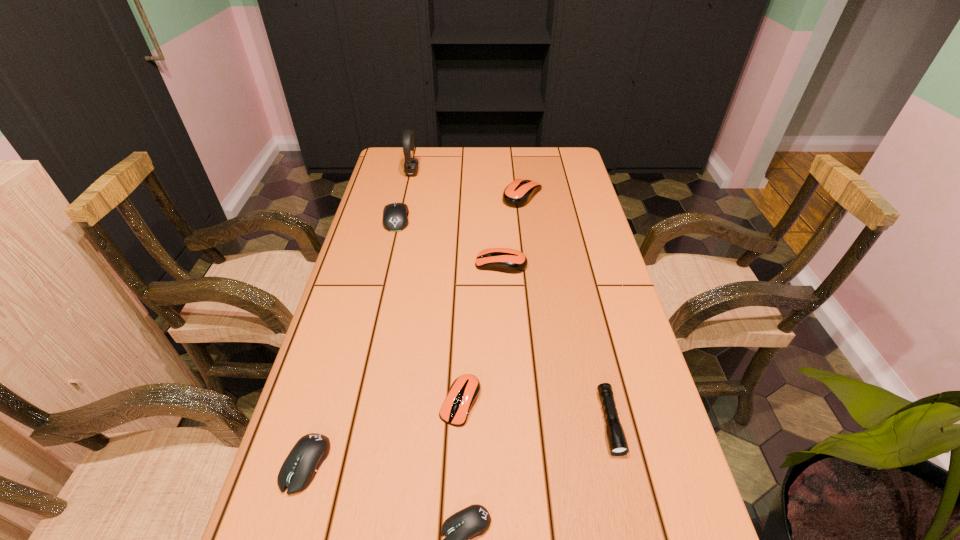
You are a GUI agent. You are given a task and a screenshot of the screen. Output one action in this format:
    pyautogui.click(x=<x>, y=<y>)
    Task: Click on the free space between the rightmost object and the biggest orange computer mouse
    
    Given the screenshot: What is the action you would take?
    pyautogui.click(x=566, y=308)

In order to click on vacant point located between the farthest black computer equipment and the black flashlight in this screenshot , I will do `click(503, 320)`.

Where is `free area in between the farthest black computer equipment and the fifth farthest computer equipment`? The width and height of the screenshot is (960, 540). free area in between the farthest black computer equipment and the fifth farthest computer equipment is located at coordinates (351, 341).

Find the location of a particular element. This screenshot has height=540, width=960. object that is the closest to the third nearest computer equipment is located at coordinates (474, 520).

Identify which object is located as the third nearest to the fourth nearest computer equipment. Please provide its 2D coordinates. Your answer should be formatted as a tuple, i.e. [(x, y)], where the tuple contains the x and y coordinates of a point satisfying the conditions above.

[(464, 391)]

Locate which computer equipment ranks third in proximity to the third farthest computer equipment. Please provide its 2D coordinates. Your answer should be formatted as a tuple, i.e. [(x, y)], where the tuple contains the x and y coordinates of a point satisfying the conditions above.

[(464, 391)]

Select which computer equipment is the fourth closest to the fifth farthest computer equipment. Please provide its 2D coordinates. Your answer should be formatted as a tuple, i.e. [(x, y)], where the tuple contains the x and y coordinates of a point satisfying the conditions above.

[(395, 215)]

Locate which orange computer mouse is the third closest to the headset. Please provide its 2D coordinates. Your answer should be formatted as a tuple, i.e. [(x, y)], where the tuple contains the x and y coordinates of a point satisfying the conditions above.

[(464, 391)]

Locate which orange computer mouse is the second closest to the second nearest black computer equipment. Please provide its 2D coordinates. Your answer should be formatted as a tuple, i.e. [(x, y)], where the tuple contains the x and y coordinates of a point satisfying the conditions above.

[(506, 260)]

Identify which black computer equipment is located as the nearest to the fifth farthest computer equipment. Please provide its 2D coordinates. Your answer should be formatted as a tuple, i.e. [(x, y)], where the tuple contains the x and y coordinates of a point satisfying the conditions above.

[(474, 520)]